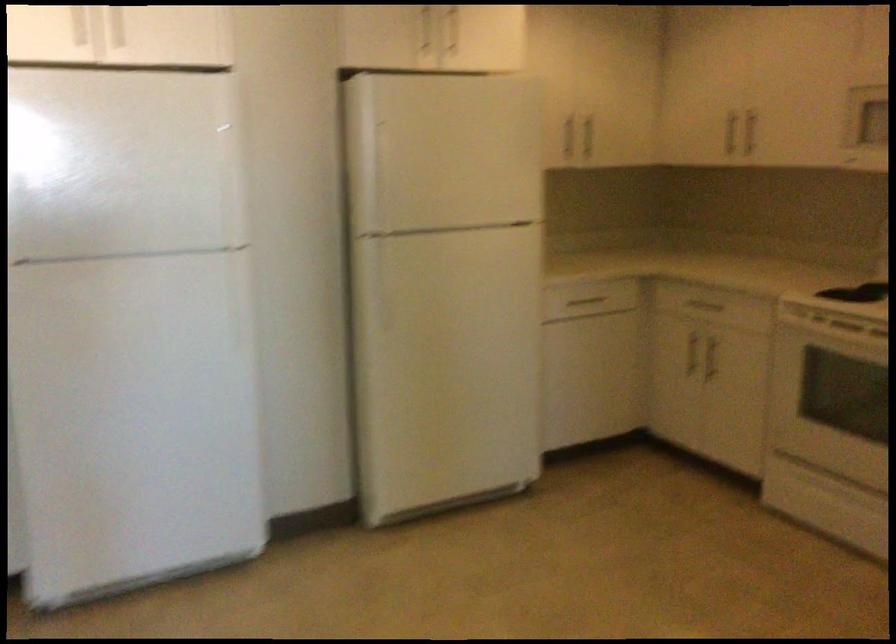
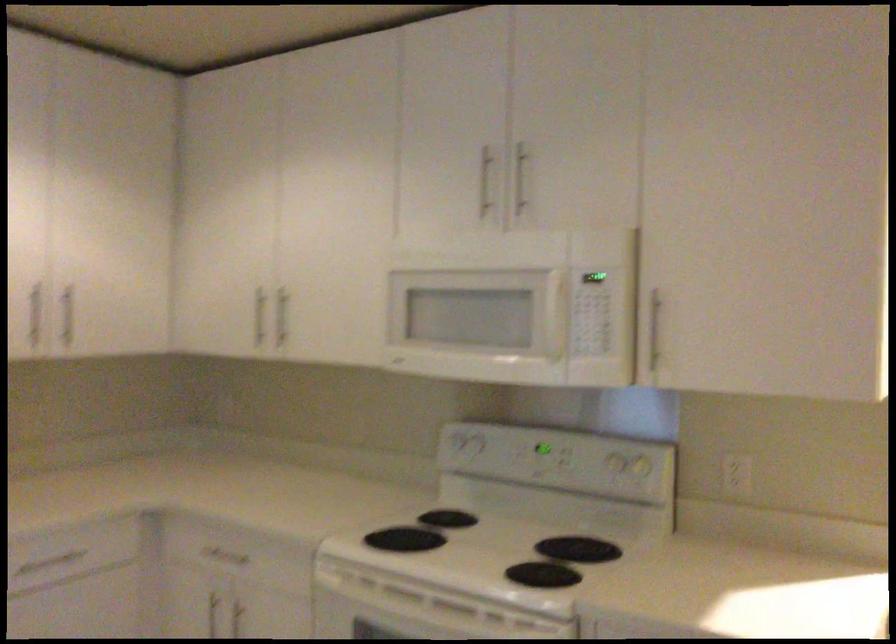
Question: The camera is either moving clockwise (left) or counter-clockwise (right) around the object. The first image is from the beginning of the video and the second image is from the end. Is the camera moving left or right when shooting the video?

Choices:
 (A) Left
 (B) Right

Answer: (A)